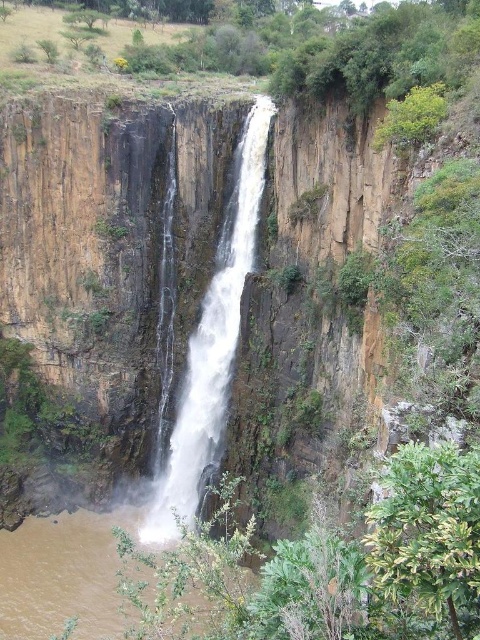
Question: Which is nearer to the brown muddy water at lower center?

Choices:
 (A) white frothy water at center
 (B) brown rock cliff at center

Answer: (A)

Question: Can you confirm if brown rock cliff at center is positioned below brown muddy water at lower center?

Choices:
 (A) yes
 (B) no

Answer: (B)

Question: Does brown rock cliff at center have a lesser width compared to brown muddy water at lower center?

Choices:
 (A) no
 (B) yes

Answer: (A)

Question: Which of the following is the closest to the observer?

Choices:
 (A) brown rock cliff at center
 (B) white frothy water at center
 (C) brown muddy water at lower center

Answer: (C)

Question: Considering the real-world distances, which object is farthest from the white frothy water at center?

Choices:
 (A) brown muddy water at lower center
 (B) brown rock cliff at center

Answer: (A)

Question: Does white frothy water at center have a larger size compared to brown muddy water at lower center?

Choices:
 (A) no
 (B) yes

Answer: (A)